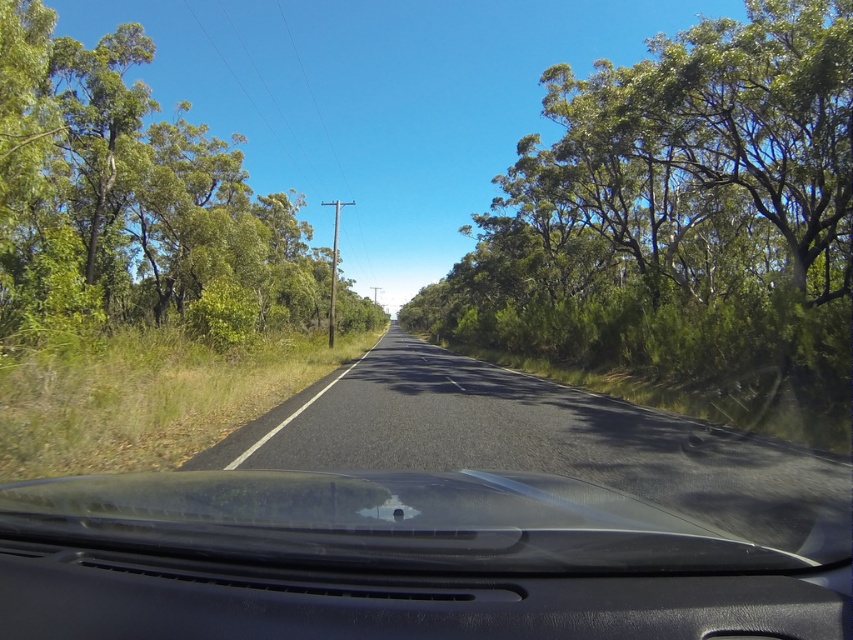
You are driving a car and looking at the road ahead. You see a green leafy tree at left and a black matte dashboard at center. Which object is closer to you?

The black matte dashboard at center is closer to you because it is positioned under the green leafy tree at left, indicating it is in the foreground.

You are driving a car and want to know if the green leafy tree at center is narrower than the green leafy tree at left. Can you confirm this based on the scene?

The green leafy tree at center is narrower than the green leafy tree at left because its width is less than the latter.

You are driving a car and need to make sure there is enough space to pass another vehicle on the road. Based on the image, is there a green leafy tree at left near the point with coordinates [132,198]? If so, how does its position affect your decision to pass?

Yes, there is a green leafy tree at left near the point with coordinates [132,198]. This tree is positioned at the left side of the road, which may limit visibility and space when attempting to pass another vehicle. It is advisable to proceed with caution or wait for a safer opportunity.